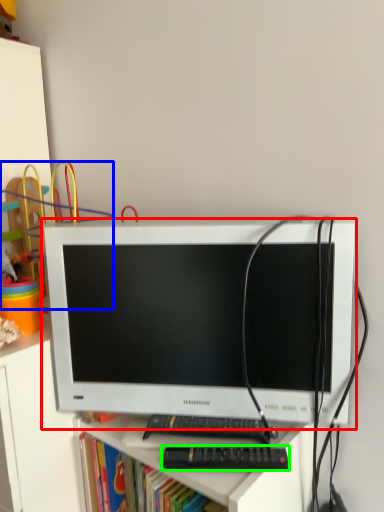
Question: Which object is positioned farthest from computer monitor (highlighted by a red box)? Select from toy (highlighted by a blue box) and control (highlighted by a green box).

Choices:
 (A) toy
 (B) control

Answer: (A)